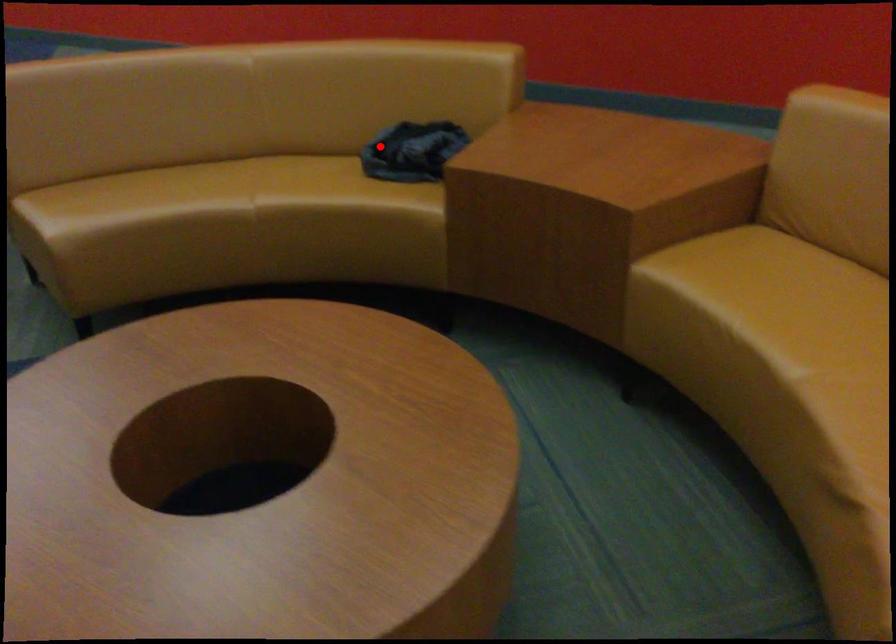
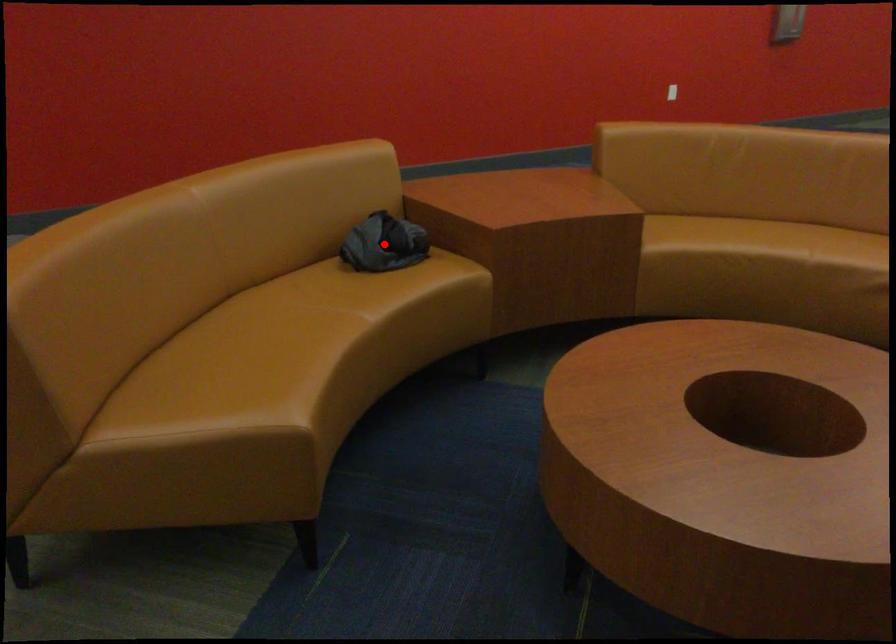
I am providing you with two images of the same scene from different viewpoints. A red point is marked on the first image and another point is marked on the second image. Is the red point in image1 aligned with the point shown in image2?

Yes